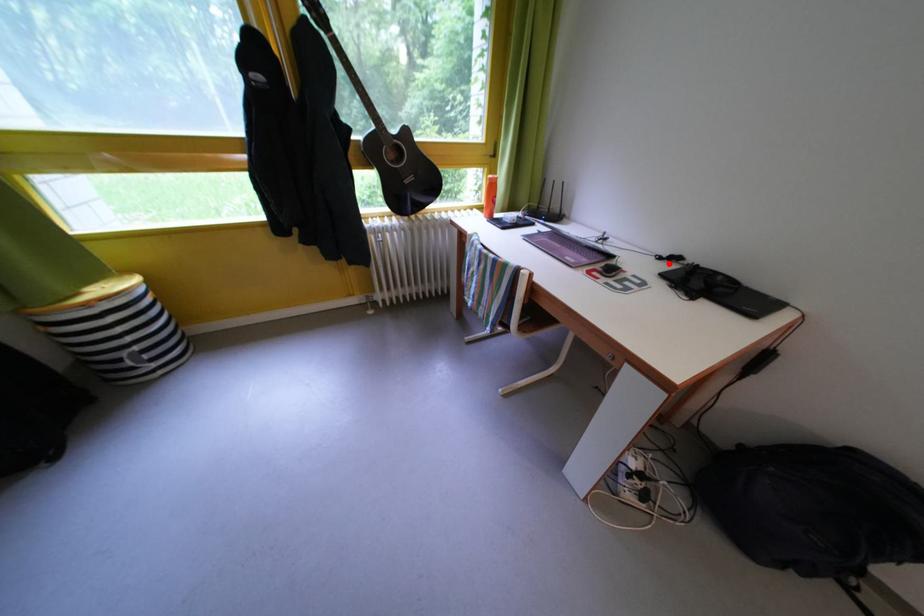
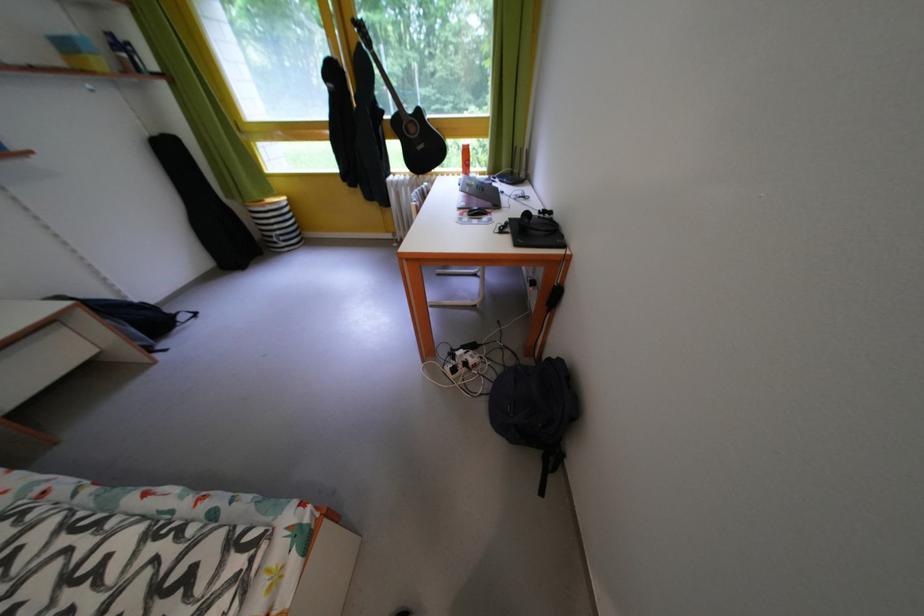
Find the pixel in the second image that matches the highlighted location in the first image.

(550, 217)